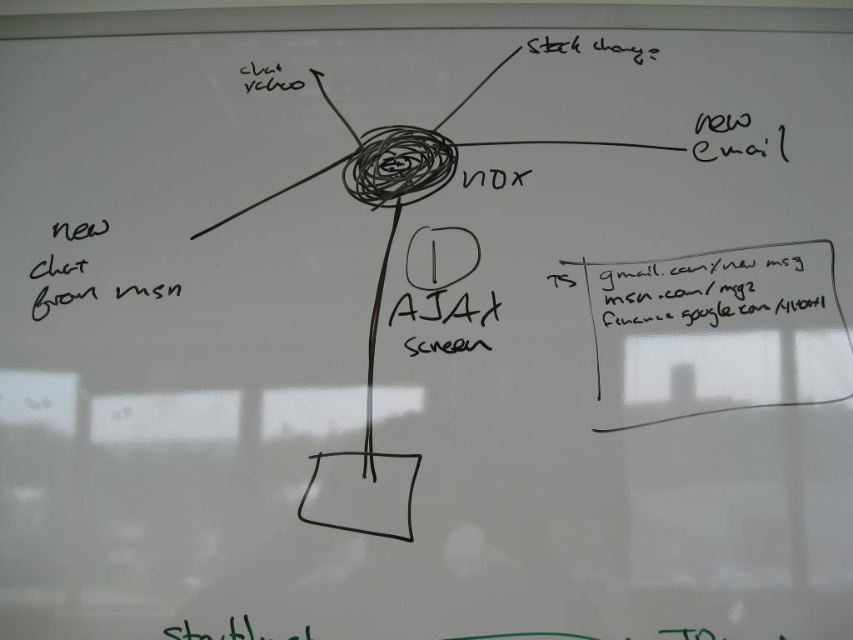
Question: Among these points, which one is nearest to the camera?

Choices:
 (A) (82, 230)
 (B) (695, 292)

Answer: (A)

Question: Can you confirm if black text at upper right is positioned above black handwritten text at lower left?

Choices:
 (A) yes
 (B) no

Answer: (B)

Question: Can you confirm if black text at upper right is positioned to the left of black handwritten text at lower left?

Choices:
 (A) no
 (B) yes

Answer: (A)

Question: Considering the relative positions of black text at upper right and black handwritten text at lower left in the image provided, where is black text at upper right located with respect to black handwritten text at lower left?

Choices:
 (A) above
 (B) below

Answer: (B)

Question: Which point is farther to the camera?

Choices:
 (A) black text at upper right
 (B) black handwritten text at lower left

Answer: (A)